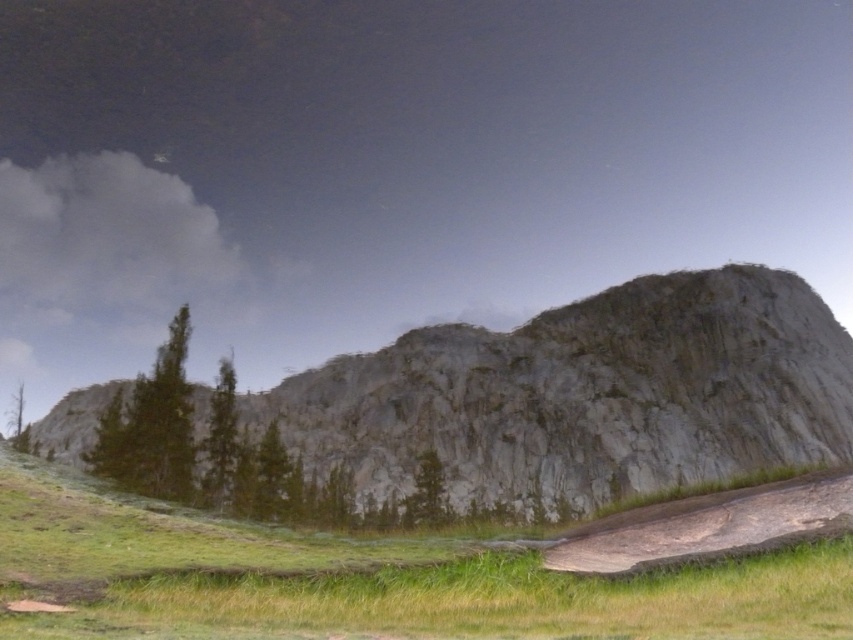
Question: Can you confirm if rugged stone mountain at center is bigger than green grassy at lower center?

Choices:
 (A) yes
 (B) no

Answer: (A)

Question: In this image, where is rugged stone mountain at center located relative to green grassy at lower center?

Choices:
 (A) below
 (B) above

Answer: (B)

Question: Can you confirm if rugged stone mountain at center is positioned to the right of green grassy at lower center?

Choices:
 (A) no
 (B) yes

Answer: (B)

Question: Among these objects, which one is farthest from the camera?

Choices:
 (A) green grassy at lower center
 (B) rugged stone mountain at center

Answer: (B)

Question: Which point is farther to the camera?

Choices:
 (A) (495, 440)
 (B) (839, 566)

Answer: (A)